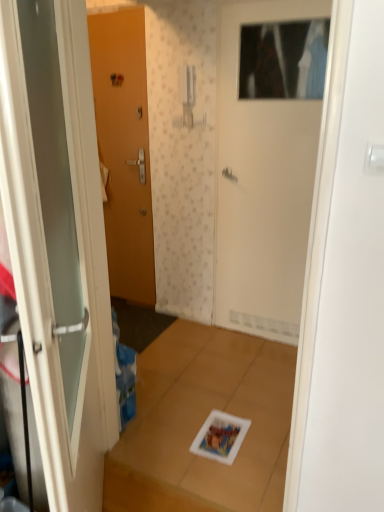
Locate an element on the screen. The width and height of the screenshot is (384, 512). free space in front of white matte door at upper center, which is the 2th door in back-to-front order is located at coordinates (254, 362).